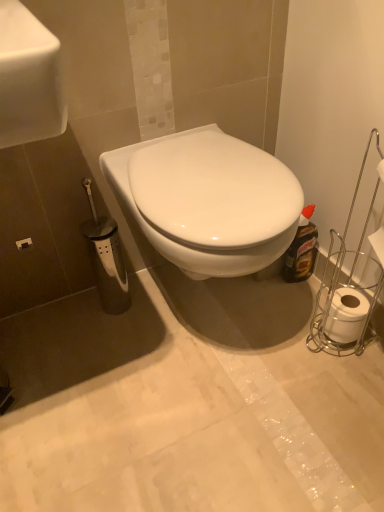
Question: Should I look upward or downward to see white matte toilet paper at right?

Choices:
 (A) up
 (B) down

Answer: (B)